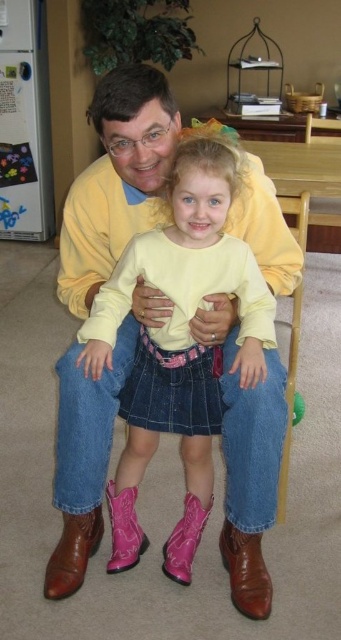
Consider the image. How much distance is there between brown leather boot at lower left and pink suede boot at lower center?

10.98 inches

Is brown leather boot at lower left smaller than pink suede boot at lower center?

Yes, brown leather boot at lower left is smaller than pink suede boot at lower center.

Describe the element at coordinates (72, 554) in the screenshot. I see `brown leather boot at lower left` at that location.

Locate an element on the screen. brown leather boot at lower left is located at coordinates (x=72, y=554).

Is point (143, 291) positioned behind point (189, 518)?

No, it is not.

Is brown leather boots at lower center taller than pink suede boot at lower center?

Yes, brown leather boots at lower center is taller than pink suede boot at lower center.

Which is behind, point (229, 492) or point (187, 532)?

The point (187, 532) is more distant.

What are the coordinates of `brown leather boots at lower center` in the screenshot? It's located at (116, 179).

Does point (121, 520) come in front of point (181, 580)?

No, (121, 520) is further to viewer.

Does pink leather boot at lower center come behind pink suede boot at lower center?

Yes.

Between point (122, 560) and point (191, 540), which one is positioned behind?

Point (191, 540)

You are a GUI agent. You are given a task and a screenshot of the screen. Output one action in this format:
    pyautogui.click(x=<x>, y=<y>)
    Task: Click on the pink leather boot at lower center
    
    Given the screenshot: What is the action you would take?
    pyautogui.click(x=124, y=529)